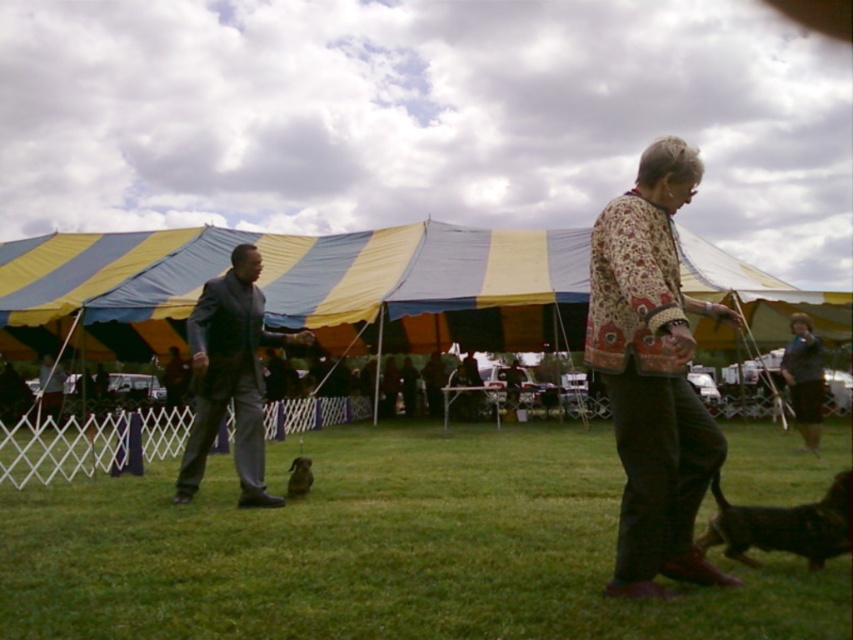
What are the coordinates of the brown fur dog at lower right?

The brown fur dog at lower right is located at point (x=781, y=525).

You are a photographer trying to capture both the brown fur dog at lower right and the brown furry dog at center in a single frame. Considering their sizes, which dog should you position closer to the camera to make them appear similar in size in the photo?

The brown fur dog at lower right is larger in size compared to the brown furry dog at center. To make them appear similar in size in the photo, you should position the smaller brown furry dog at center closer to the camera while keeping the larger brown fur dog at lower right farther away.